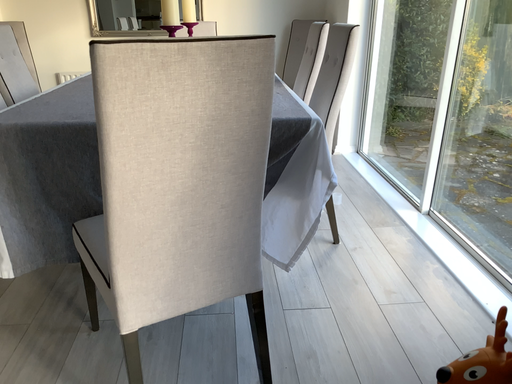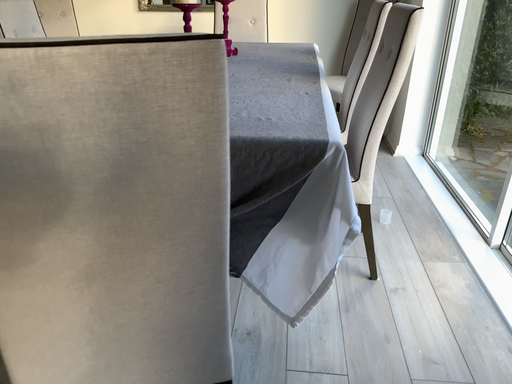
Question: Which way did the camera rotate in the video?

Choices:
 (A) rotated left
 (B) rotated right

Answer: (A)